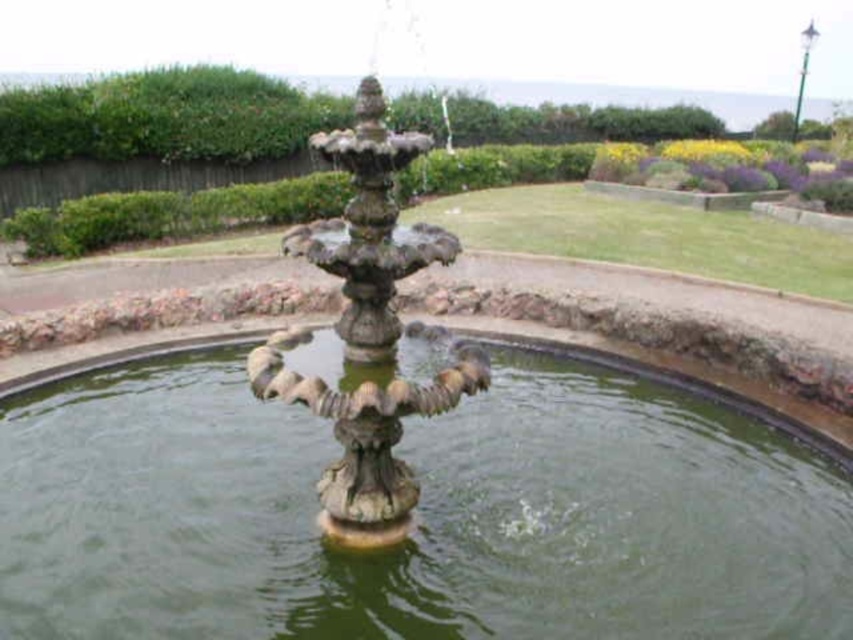
You are standing in the garden and see the point labeled as point (418, 515). Based on the scene description, where is this point located?

The point (418, 515) is located on the green stone water at center.